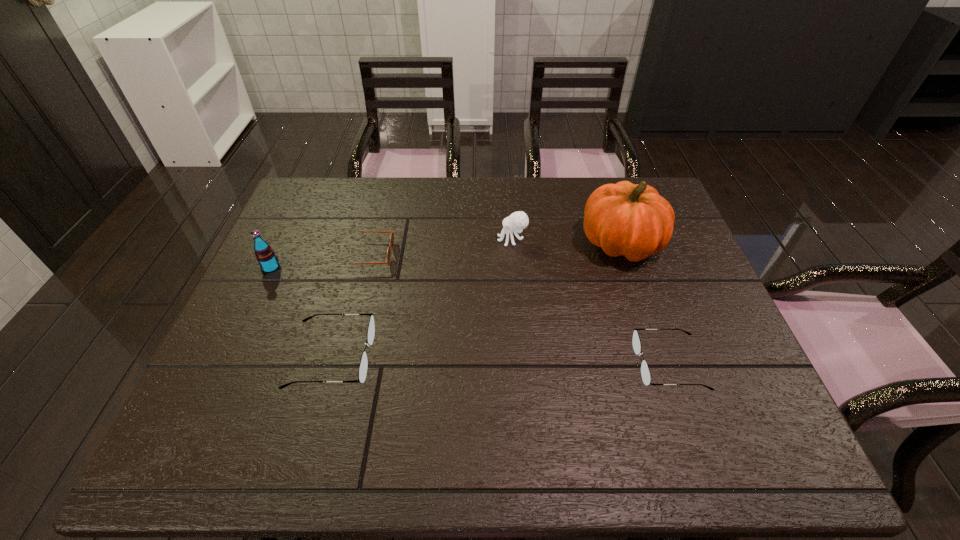
You are a GUI agent. You are given a task and a screenshot of the screen. Output one action in this format:
    pyautogui.click(x=<x>, y=<y>)
    Task: Click on the object situated at the left edge
    
    Given the screenshot: What is the action you would take?
    pyautogui.click(x=265, y=255)

Locate an element on the screen. The image size is (960, 540). spectacles that is at the right edge is located at coordinates (645, 372).

Find the location of a particular element. pumpkin that is at the right edge is located at coordinates (625, 219).

The width and height of the screenshot is (960, 540). Identify the location of object positioned at the far right corner. (625, 219).

Locate an element on the screen. This screenshot has width=960, height=540. object that is at the near right corner is located at coordinates (645, 372).

You are a GUI agent. You are given a task and a screenshot of the screen. Output one action in this format:
    pyautogui.click(x=<x>, y=<y>)
    Task: Click on the vacant space at the far edge of the desktop
    The height and width of the screenshot is (540, 960).
    Given the screenshot: What is the action you would take?
    pyautogui.click(x=544, y=187)

Locate an element on the screen. free region at the near edge of the desktop is located at coordinates (557, 406).

Find the location of `vacant region at the left edge of the desktop`. vacant region at the left edge of the desktop is located at coordinates (333, 228).

This screenshot has height=540, width=960. What are the coordinates of `vacant space at the right edge of the desktop` in the screenshot? It's located at (709, 364).

The image size is (960, 540). In the image, there is a desktop. In order to click on vacant space at the far left corner in this screenshot , I will do `click(323, 189)`.